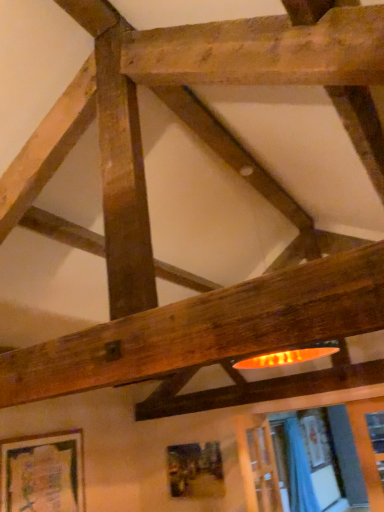
What is the approximate height of blue fabric curtain at lower right?

blue fabric curtain at lower right is 1.60 meters in height.

What do you see at coordinates (195, 470) in the screenshot?
I see `wooden textured picture frame at lower center, acting as the second picture frame starting from the left` at bounding box center [195, 470].

The image size is (384, 512). Find the location of `blue fabric curtain at lower right`. blue fabric curtain at lower right is located at coordinates (299, 470).

From a real-world perspective, is wooden frame at lower left, the 1th picture frame positioned from the front, on top of wooden textured picture frame at lower center, which is the 1th picture frame from right to left?

Yes, from a real-world perspective, wooden frame at lower left, the 1th picture frame positioned from the front, is above wooden textured picture frame at lower center, which is the 1th picture frame from right to left.

From the image's perspective, between wooden frame at lower left, placed as the second picture frame when sorted from right to left, and wooden textured picture frame at lower center, arranged as the 2th picture frame when viewed from the front, who is located below?

From the image's view, wooden textured picture frame at lower center, arranged as the 2th picture frame when viewed from the front, is below.

Considering the relative positions of wooden frame at lower left, which is the second picture frame in back-to-front order, and wooden textured picture frame at lower center, acting as the second picture frame starting from the left, in the image provided, is wooden frame at lower left, which is the second picture frame in back-to-front order, to the left or to the right of wooden textured picture frame at lower center, acting as the second picture frame starting from the left,?

wooden frame at lower left, which is the second picture frame in back-to-front order, is to the left of wooden textured picture frame at lower center, acting as the second picture frame starting from the left.

Considering the points (42, 443) and (214, 450), which point is behind, point (42, 443) or point (214, 450)?

The point (214, 450) is behind.

Considering the relative sizes of wooden frame at lower left, which is the second picture frame in back-to-front order, and blue fabric curtain at lower right in the image provided, is wooden frame at lower left, which is the second picture frame in back-to-front order, thinner than blue fabric curtain at lower right?

Indeed, wooden frame at lower left, which is the second picture frame in back-to-front order, has a lesser width compared to blue fabric curtain at lower right.

Who is smaller, wooden frame at lower left, acting as the 1th picture frame starting from the left, or blue fabric curtain at lower right?

With smaller size is wooden frame at lower left, acting as the 1th picture frame starting from the left.

From a real-world perspective, is wooden frame at lower left, placed as the second picture frame when sorted from right to left, physically below blue fabric curtain at lower right?

No, from a real-world perspective, wooden frame at lower left, placed as the second picture frame when sorted from right to left, is not below blue fabric curtain at lower right.

Does point (23, 482) appear closer or farther from the camera than point (318, 503)?

Point (23, 482) is positioned closer to the camera compared to point (318, 503).

Is blue fabric curtain at lower right touching wooden frame at lower left, the 1th picture frame positioned from the front?

blue fabric curtain at lower right and wooden frame at lower left, the 1th picture frame positioned from the front, are clearly separated.

Is point (297, 468) farther from viewer compared to point (73, 450)?

That is True.

Can you confirm if blue fabric curtain at lower right is taller than wooden frame at lower left, placed as the second picture frame when sorted from right to left?

Yes.

Is blue fabric curtain at lower right further to camera compared to wooden frame at lower left, acting as the 1th picture frame starting from the left?

Yes, it is behind wooden frame at lower left, acting as the 1th picture frame starting from the left.

Is blue fabric curtain at lower right outside of wooden textured picture frame at lower center, which is the 1th picture frame from back to front?

Yes.

Which is more to the right, blue fabric curtain at lower right or wooden textured picture frame at lower center, arranged as the 2th picture frame when viewed from the front?

blue fabric curtain at lower right.

Considering the relative sizes of blue fabric curtain at lower right and wooden textured picture frame at lower center, acting as the second picture frame starting from the left, in the image provided, is blue fabric curtain at lower right wider than wooden textured picture frame at lower center, acting as the second picture frame starting from the left,?

Yes, blue fabric curtain at lower right is wider than wooden textured picture frame at lower center, acting as the second picture frame starting from the left.

Could you tell me if wooden textured picture frame at lower center, acting as the second picture frame starting from the left, is turned towards blue fabric curtain at lower right?

No.

Image resolution: width=384 pixels, height=512 pixels. In order to click on the 1st picture frame positioned above the blue fabric curtain at lower right (from a real-world perspective) in this screenshot , I will do `click(195, 470)`.

Does wooden textured picture frame at lower center, which is the 1th picture frame from back to front, contain blue fabric curtain at lower right?

Actually, blue fabric curtain at lower right is outside wooden textured picture frame at lower center, which is the 1th picture frame from back to front.

Where is `picture frame to the right of wooden frame at lower left, the 1th picture frame positioned from the front`? This screenshot has width=384, height=512. picture frame to the right of wooden frame at lower left, the 1th picture frame positioned from the front is located at coordinates (195, 470).

Is wooden textured picture frame at lower center, which is the 1th picture frame from right to left, directly adjacent to wooden frame at lower left, placed as the second picture frame when sorted from right to left?

wooden textured picture frame at lower center, which is the 1th picture frame from right to left, and wooden frame at lower left, placed as the second picture frame when sorted from right to left, are not in contact.

Is wooden textured picture frame at lower center, which is the 1th picture frame from right to left, oriented towards wooden frame at lower left, the 1th picture frame positioned from the front?

Yes, wooden textured picture frame at lower center, which is the 1th picture frame from right to left, is turned towards wooden frame at lower left, the 1th picture frame positioned from the front.

Does wooden textured picture frame at lower center, which is the 1th picture frame from right to left, have a greater width compared to wooden frame at lower left, the 1th picture frame positioned from the front?

In fact, wooden textured picture frame at lower center, which is the 1th picture frame from right to left, might be narrower than wooden frame at lower left, the 1th picture frame positioned from the front.

The height and width of the screenshot is (512, 384). I want to click on picture frame that is below the wooden frame at lower left, the 1th picture frame positioned from the front (from the image's perspective), so (195, 470).

The image size is (384, 512). Find the location of `the 2nd picture frame positioned above the blue fabric curtain at lower right (from the image's perspective)`. the 2nd picture frame positioned above the blue fabric curtain at lower right (from the image's perspective) is located at coordinates pyautogui.click(x=42, y=473).

Estimate the real-world distances between objects in this image. Which object is further from blue fabric curtain at lower right, wooden textured picture frame at lower center, which is the 1th picture frame from right to left, or wooden frame at lower left, which is the second picture frame in back-to-front order?

Among the two, wooden frame at lower left, which is the second picture frame in back-to-front order, is located further to blue fabric curtain at lower right.

Which object lies further to the anchor point wooden textured picture frame at lower center, which is the 1th picture frame from right to left, wooden frame at lower left, which is the second picture frame in back-to-front order, or blue fabric curtain at lower right?

Answer: Among the two, wooden frame at lower left, which is the second picture frame in back-to-front order, is located further to wooden textured picture frame at lower center, which is the 1th picture frame from right to left.

Estimate the real-world distances between objects in this image. Which object is further from wooden frame at lower left, which is the second picture frame in back-to-front order, blue fabric curtain at lower right or wooden textured picture frame at lower center, which is the 1th picture frame from back to front?

Based on the image, blue fabric curtain at lower right appears to be further to wooden frame at lower left, which is the second picture frame in back-to-front order.

Based on their spatial positions, is wooden frame at lower left, which is the second picture frame in back-to-front order, or wooden textured picture frame at lower center, arranged as the 2th picture frame when viewed from the front, further from blue fabric curtain at lower right?

wooden frame at lower left, which is the second picture frame in back-to-front order.

Looking at this image, looking at the image, which one is located further to wooden frame at lower left, which is the second picture frame in back-to-front order, wooden textured picture frame at lower center, arranged as the 2th picture frame when viewed from the front, or blue fabric curtain at lower right?

blue fabric curtain at lower right.

When comparing their distances from wooden textured picture frame at lower center, arranged as the 2th picture frame when viewed from the front, does blue fabric curtain at lower right or wooden frame at lower left, the 1th picture frame positioned from the front, seem closer?

Based on the image, blue fabric curtain at lower right appears to be nearer to wooden textured picture frame at lower center, arranged as the 2th picture frame when viewed from the front.

The width and height of the screenshot is (384, 512). Identify the location of picture frame between wooden frame at lower left, acting as the 1th picture frame starting from the left, and blue fabric curtain at lower right in the front-back direction. (195, 470).